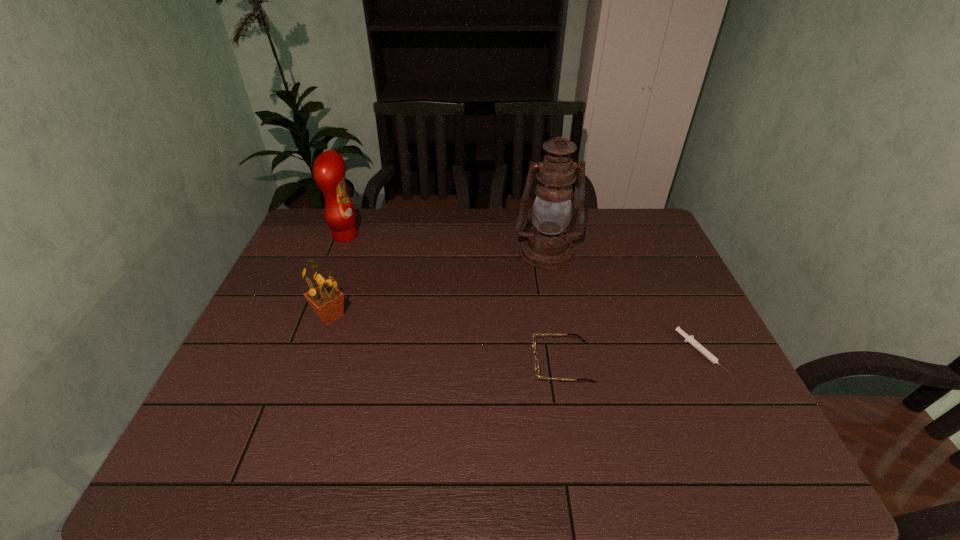
Locate an element on the screen. Image resolution: width=960 pixels, height=540 pixels. vacant area situated 0.140m on the lenses of the spectacles is located at coordinates (476, 362).

The image size is (960, 540). I want to click on free space located on the lenses of the spectacles, so click(396, 362).

Image resolution: width=960 pixels, height=540 pixels. What are the coordinates of `vacant area situated 0.140m on the lenses of the spectacles` in the screenshot? It's located at (476, 362).

Find the location of a particular element. vacant space positioned on the back of the rightmost object is located at coordinates (671, 292).

At what (x,y) coordinates should I click in order to perform the action: click on oil lamp that is positioned at the far edge. Please return your answer as a coordinate pair (x, y). Looking at the image, I should click on (548, 245).

The image size is (960, 540). I want to click on condiment that is positioned at the far edge, so click(x=329, y=170).

Image resolution: width=960 pixels, height=540 pixels. Find the location of `condiment present at the left edge`. condiment present at the left edge is located at coordinates (329, 170).

Find the location of a particular element. The width and height of the screenshot is (960, 540). sunflower that is at the left edge is located at coordinates (327, 301).

Find the location of `object that is at the right edge`. object that is at the right edge is located at coordinates (690, 339).

Locate an element on the screen. The width and height of the screenshot is (960, 540). object located in the far left corner section of the desktop is located at coordinates (329, 170).